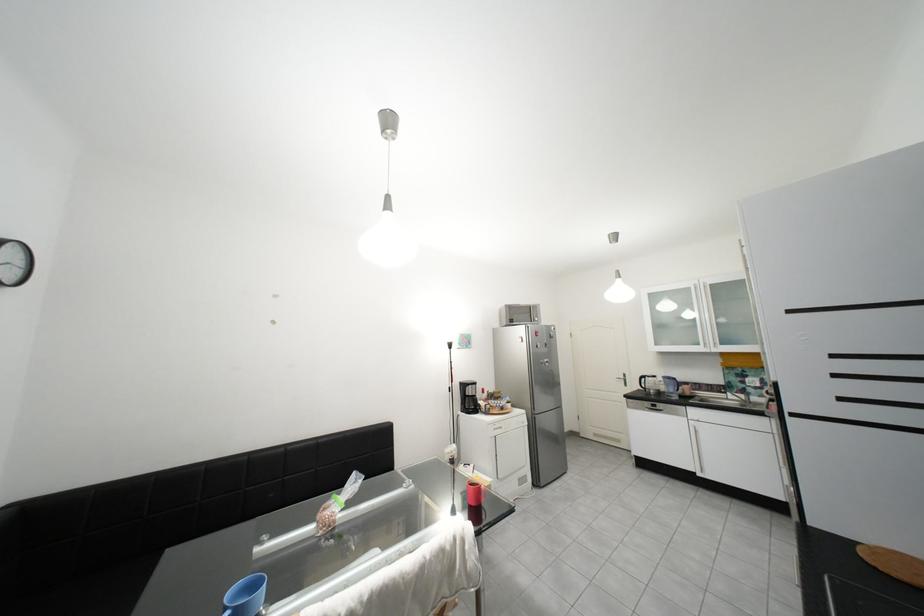
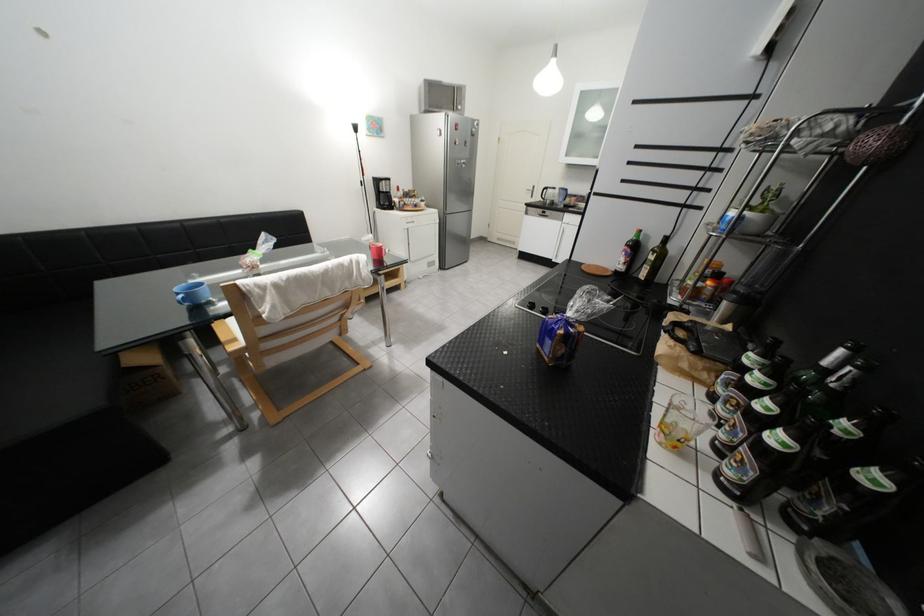
Where in the second image is the point corresponding to [531,331] from the first image?

(451, 121)